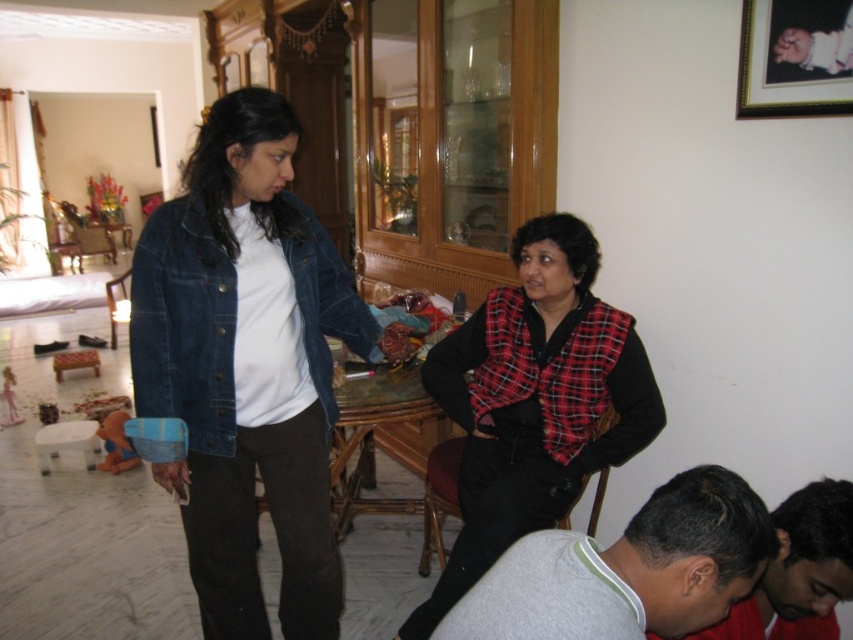
How distant is gray fleece shirt at lower right from wooden picture frame at upper right?

gray fleece shirt at lower right is 4.02 feet from wooden picture frame at upper right.

Which is below, gray fleece shirt at lower right or wooden picture frame at upper right?

gray fleece shirt at lower right

Identify the location of gray fleece shirt at lower right. This screenshot has height=640, width=853. pyautogui.click(x=627, y=570).

I want to click on gray fleece shirt at lower right, so click(627, 570).

Can you confirm if gray fleece shirt at lower right is positioned below white plastic stool at lower left?

Incorrect, gray fleece shirt at lower right is not positioned below white plastic stool at lower left.

Is gray fleece shirt at lower right thinner than white plastic stool at lower left?

In fact, gray fleece shirt at lower right might be wider than white plastic stool at lower left.

Locate an element on the screen. The image size is (853, 640). gray fleece shirt at lower right is located at coordinates (627, 570).

Locate an element on the screen. gray fleece shirt at lower right is located at coordinates (627, 570).

Is denim jacket at center positioned at the back of wooden picture frame at upper right?

Yes, it is.

From the picture: Which is more to the right, denim jacket at center or wooden picture frame at upper right?

Positioned to the right is wooden picture frame at upper right.

What do you see at coordinates (248, 365) in the screenshot? I see `denim jacket at center` at bounding box center [248, 365].

The height and width of the screenshot is (640, 853). Find the location of `denim jacket at center`. denim jacket at center is located at coordinates (248, 365).